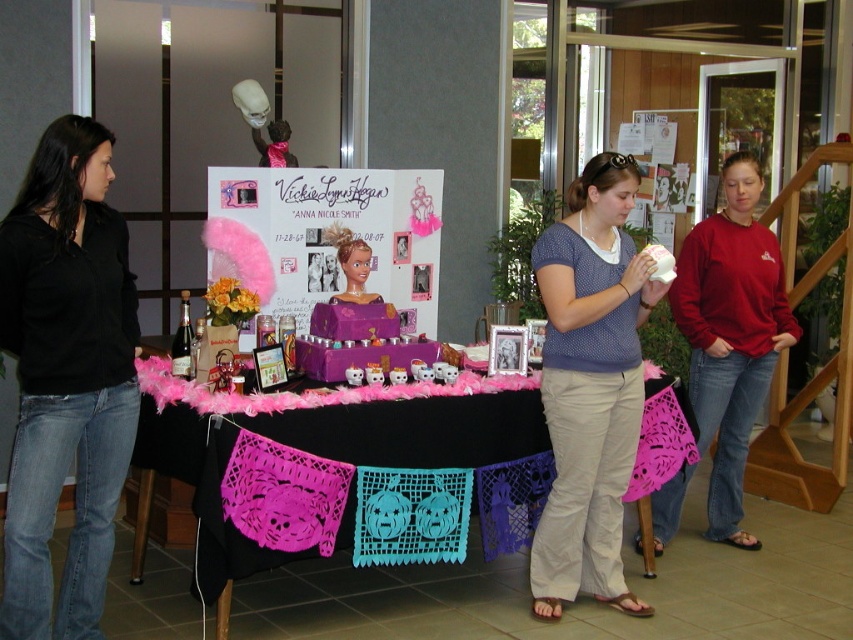
Question: Which of the following is the farthest from the observer?

Choices:
 (A) (339, 262)
 (B) (613, 502)

Answer: (A)

Question: Does pink lace table at center appear under matte pink barbie doll at center?

Choices:
 (A) no
 (B) yes

Answer: (B)

Question: Based on their relative distances, which object is nearer to the pink lace table at center?

Choices:
 (A) matte pink barbie doll at center
 (B) matte blue blouse at center

Answer: (B)

Question: Is black denim jeans at left thinner than matte blue blouse at center?

Choices:
 (A) no
 (B) yes

Answer: (B)

Question: Considering the real-world distances, which object is farthest from the matte pink barbie doll at center?

Choices:
 (A) matte blue blouse at center
 (B) red cotton sweatshirt at center
 (C) black denim jeans at left
 (D) pink feather boa at center

Answer: (B)

Question: Does red cotton sweatshirt at center appear on the left side of matte pink barbie doll at center?

Choices:
 (A) no
 (B) yes

Answer: (A)